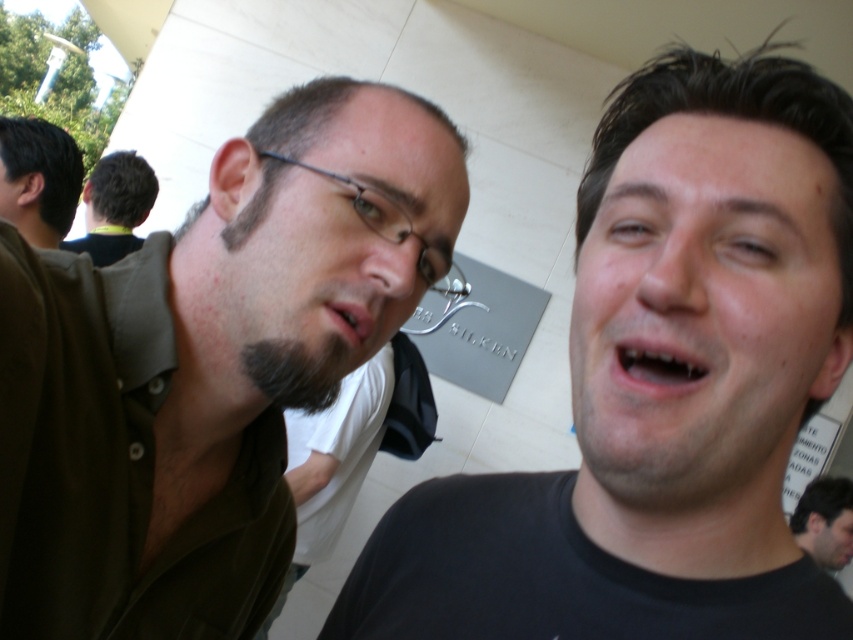
You are a photographer trying to capture a clear photo of the smooth skin face at right and the dark brown hair at left. Which object should you focus on first to ensure both are in focus?

The smooth skin face at right is in front of the dark brown hair at left, so you should focus on the smooth skin face at right first to ensure both are in focus.

You are a photographer trying to capture a portrait of both individuals. Since the smooth skin face at right and the dark brown hair at left are in the frame, can you tell me which one is positioned lower in the image?

The smooth skin face at right is positioned lower than the dark brown hair at left because the smooth skin face at right is below dark brown hair at left.